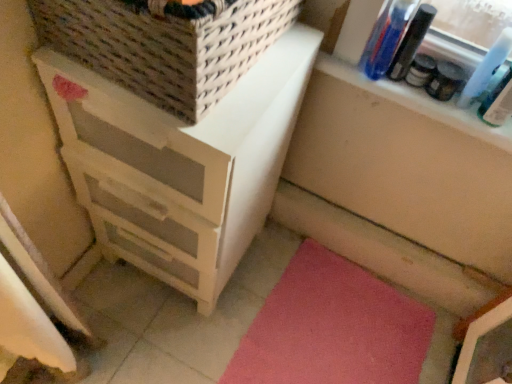
The height and width of the screenshot is (384, 512). I want to click on vacant area on top of pink carpet at lower right (from a real-world perspective), so click(349, 340).